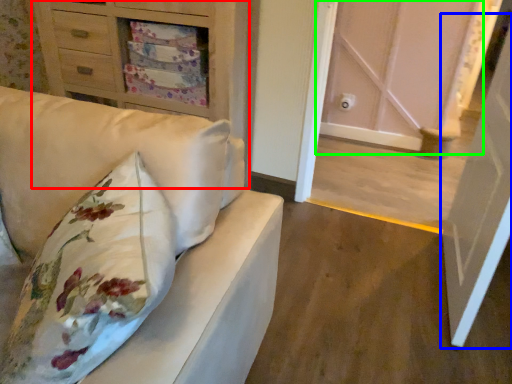
Question: Which object is the farthest from chest of drawers (highlighted by a red box)? Choose among these: door (highlighted by a blue box) or door (highlighted by a green box).

Choices:
 (A) door
 (B) door

Answer: (B)